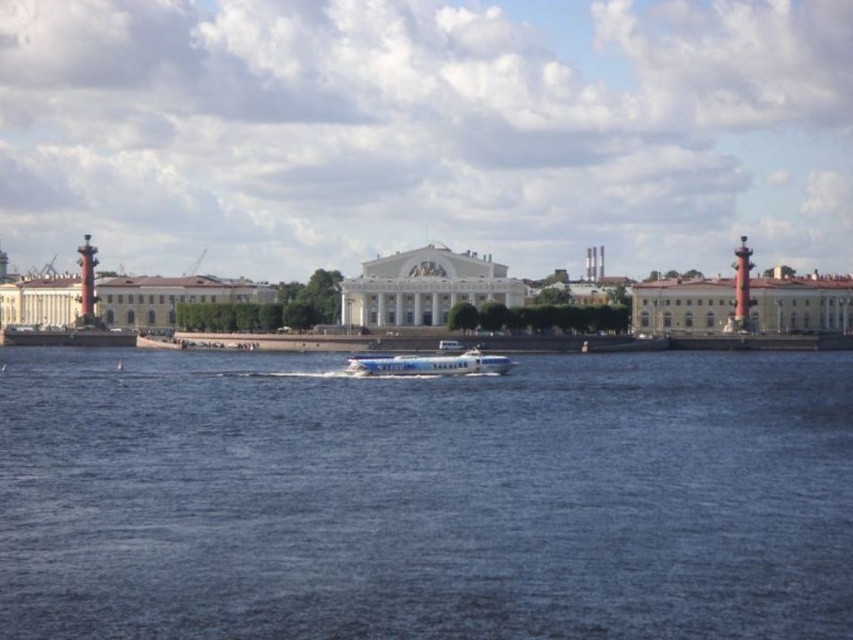
You are standing on the dock and want to reach the white glossy building at center. The white glossy boat at center is currently 17.67 meters away from the building. If the boat can travel at 2 meters per second, how long will it take for the boat to reach the building?

The distance between the white glossy building at center and the white glossy boat at center is 17.67 meters. At a speed of 2 meters per second, the boat will take approximately 8.835 seconds to reach the building.